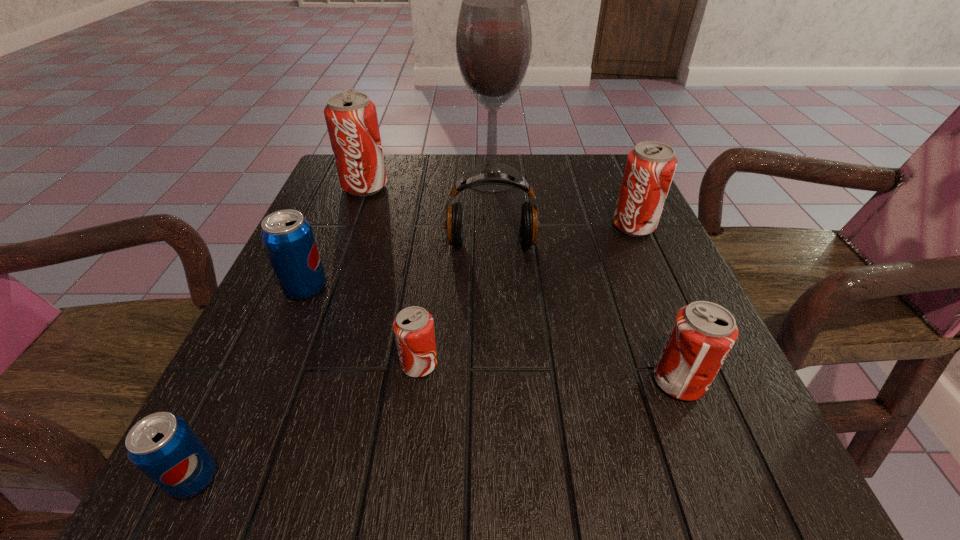
Where is `free space that satisfies the following two spatial constraints: 1. on the front side of the bigger blue pop soda; 2. on the right side of the second smallest pink soda can`? The image size is (960, 540). free space that satisfies the following two spatial constraints: 1. on the front side of the bigger blue pop soda; 2. on the right side of the second smallest pink soda can is located at coordinates (265, 382).

I want to click on vacant area that satisfies the following two spatial constraints: 1. on the front side of the second pink soda can from left to right; 2. on the left side of the second smallest pink soda can, so click(417, 382).

Image resolution: width=960 pixels, height=540 pixels. Identify the location of free region that satisfies the following two spatial constraints: 1. on the ear cups of the headset; 2. on the left side of the second smallest pink soda can. (495, 382).

This screenshot has height=540, width=960. I want to click on free location that satisfies the following two spatial constraints: 1. on the back side of the smallest pink soda can; 2. on the right side of the nearest object, so click(248, 364).